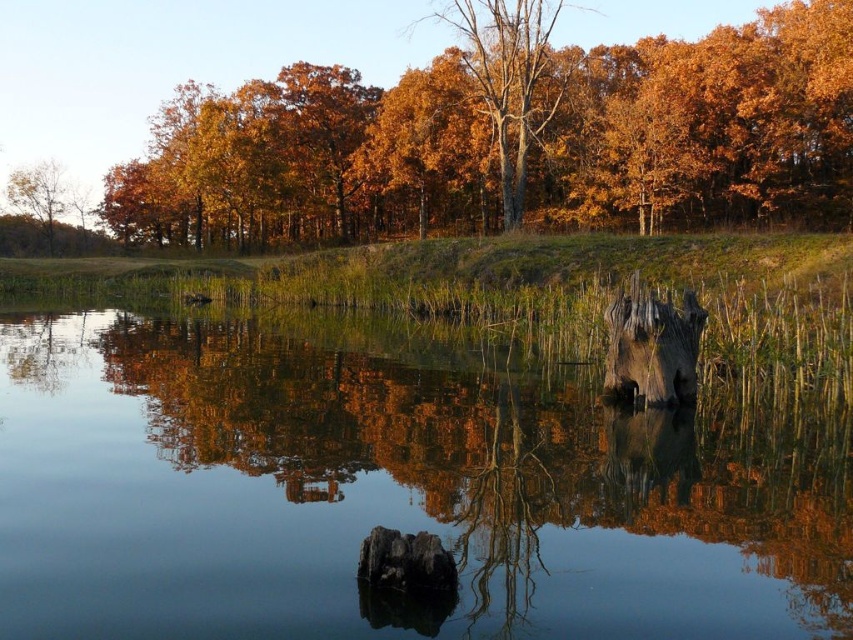
Question: Does smooth water at center have a greater width compared to golden wood tree at center?

Choices:
 (A) yes
 (B) no

Answer: (A)

Question: Does smooth water at center have a greater width compared to golden wood tree at center?

Choices:
 (A) yes
 (B) no

Answer: (A)

Question: Among these objects, which one is nearest to the camera?

Choices:
 (A) smooth brown tree trunk at upper left
 (B) smooth water at center
 (C) golden wood tree at center
 (D) orange matte tree at upper center

Answer: (B)

Question: Based on their relative distances, which object is farther from the orange matte tree at upper center?

Choices:
 (A) golden wood tree at center
 (B) smooth water at center
 (C) smooth brown tree trunk at upper left

Answer: (B)

Question: Is smooth water at center thinner than golden wood tree at center?

Choices:
 (A) yes
 (B) no

Answer: (B)

Question: Which object is farther from the camera taking this photo?

Choices:
 (A) orange matte tree at upper center
 (B) smooth brown tree trunk at upper left

Answer: (B)